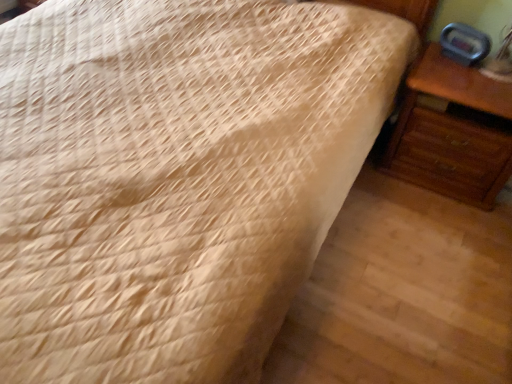
Describe the element at coordinates (453, 132) in the screenshot. I see `brown wood nightstand at right` at that location.

You are a GUI agent. You are given a task and a screenshot of the screen. Output one action in this format:
    pyautogui.click(x=<x>, y=<y>)
    Task: Click on the brown wood nightstand at right
    This screenshot has height=384, width=512.
    Given the screenshot: What is the action you would take?
    pyautogui.click(x=453, y=132)

Identify the location of brown wood nightstand at right. This screenshot has height=384, width=512. (453, 132).